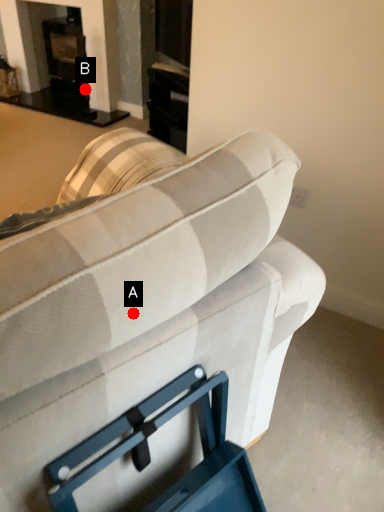
Question: Two points are circled on the image, labeled by A and B beside each circle. Which point is closer to the camera?

Choices:
 (A) A is closer
 (B) B is closer

Answer: (A)